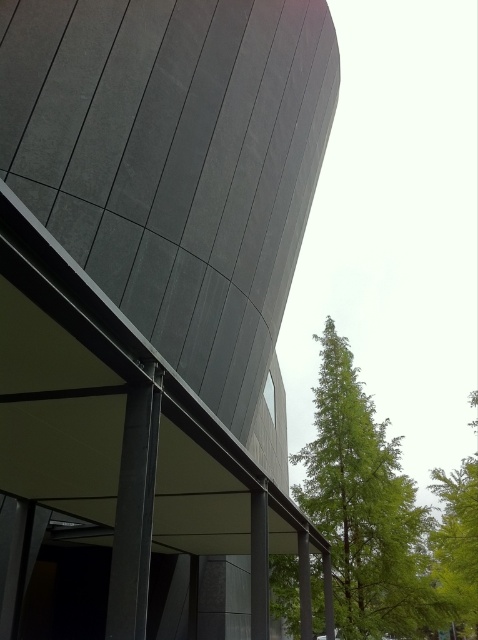
Question: Which point is closer to the camera taking this photo?

Choices:
 (A) (456, 468)
 (B) (234, 461)
 (C) (425, 584)

Answer: (B)

Question: Is green leafy tree at right positioned in front of green leafy tree at upper right?

Choices:
 (A) yes
 (B) no

Answer: (B)

Question: Is matte gray building at center smaller than green leafy tree at right?

Choices:
 (A) yes
 (B) no

Answer: (B)

Question: Is matte gray building at center further to the viewer compared to green leafy tree at upper right?

Choices:
 (A) yes
 (B) no

Answer: (B)

Question: Which of the following is the closest to the observer?

Choices:
 (A) green leafy tree at upper right
 (B) matte gray building at center
 (C) green leafy tree at right

Answer: (B)

Question: Which object appears farthest from the camera in this image?

Choices:
 (A) green leafy tree at upper right
 (B) green leafy tree at right
 (C) matte gray building at center

Answer: (B)